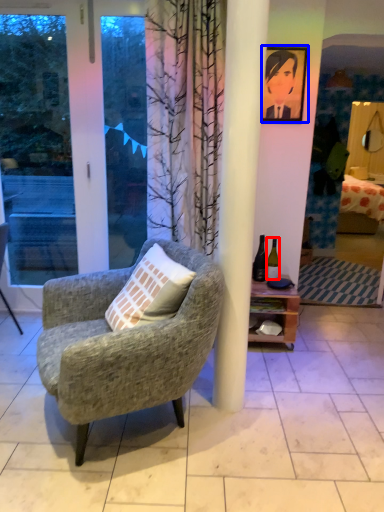
Question: Which point is further to the camera, bottle (highlighted by a red box) or picture frame (highlighted by a blue box)?

Choices:
 (A) bottle
 (B) picture frame

Answer: (A)